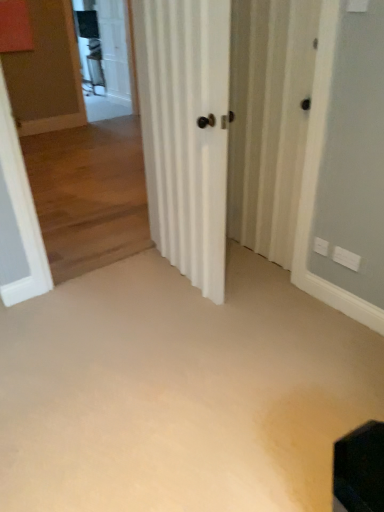
Question: In which direction should I rotate to look at white striped screen door at center, which is counted as the second screen door, starting from the back?

Choices:
 (A) right
 (B) left

Answer: (A)

Question: Is white matte door at center to the left of white striped screen door at center, which appears as the first screen door when viewed from the front, from the viewer's perspective?

Choices:
 (A) no
 (B) yes

Answer: (B)

Question: From a real-world perspective, is white matte door at center below white striped screen door at center, which is counted as the second screen door, starting from the back?

Choices:
 (A) yes
 (B) no

Answer: (B)

Question: Are white matte door at center and white striped screen door at center, which appears as the first screen door when viewed from the front, located far from each other?

Choices:
 (A) no
 (B) yes

Answer: (A)

Question: Considering the relative positions of white matte door at center and white striped screen door at center, positioned as the second screen door in top-to-bottom order, in the image provided, is white matte door at center behind white striped screen door at center, positioned as the second screen door in top-to-bottom order,?

Choices:
 (A) yes
 (B) no

Answer: (B)

Question: Can you confirm if white matte door at center is smaller than white striped screen door at center, the first screen door viewed from the right?

Choices:
 (A) no
 (B) yes

Answer: (A)

Question: Is white matte door at center oriented away from white striped screen door at center, which appears as the first screen door when viewed from the front?

Choices:
 (A) no
 (B) yes

Answer: (B)

Question: Would you consider clear glass screen door at upper left, the first screen door positioned from the left, to be distant from white striped screen door at center, the first screen door viewed from the right?

Choices:
 (A) no
 (B) yes

Answer: (B)

Question: Is clear glass screen door at upper left, which appears as the 1th screen door when viewed from the top, outside white striped screen door at center, the first screen door viewed from the right?

Choices:
 (A) yes
 (B) no

Answer: (A)

Question: From the image's perspective, would you say clear glass screen door at upper left, the first screen door positioned from the left, is positioned over white striped screen door at center, which is counted as the first screen door, starting from the bottom?

Choices:
 (A) yes
 (B) no

Answer: (A)

Question: Is white striped screen door at center, the first screen door viewed from the right, a part of clear glass screen door at upper left, the 1th screen door from the back?

Choices:
 (A) no
 (B) yes

Answer: (A)

Question: Does clear glass screen door at upper left, which appears as the 1th screen door when viewed from the top, have a smaller size compared to white striped screen door at center, which is counted as the second screen door, starting from the back?

Choices:
 (A) yes
 (B) no

Answer: (B)

Question: Considering the relative sizes of clear glass screen door at upper left, the 2th screen door when ordered from front to back, and white striped screen door at center, the first screen door viewed from the right, in the image provided, is clear glass screen door at upper left, the 2th screen door when ordered from front to back, thinner than white striped screen door at center, the first screen door viewed from the right,?

Choices:
 (A) no
 (B) yes

Answer: (A)

Question: Does beige carpet at center have a smaller size compared to white matte door at center?

Choices:
 (A) no
 (B) yes

Answer: (B)